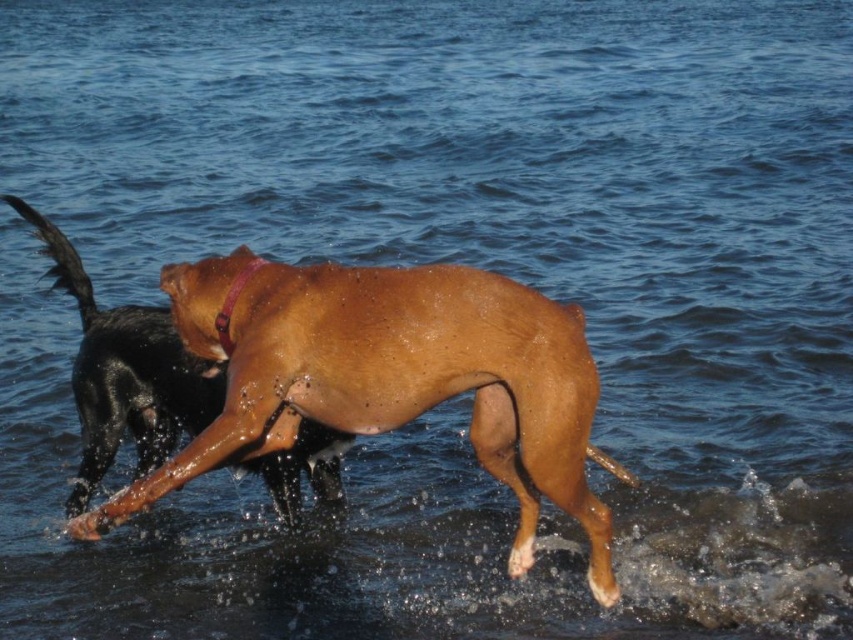
Question: Can you confirm if sandy brown fur at center is smaller than brown leather neckband at center?

Choices:
 (A) no
 (B) yes

Answer: (A)

Question: Which point appears closest to the camera in this image?

Choices:
 (A) pos(225,316)
 (B) pos(323,449)

Answer: (A)

Question: Is sandy brown fur at center smaller than brown glossy dog at center?

Choices:
 (A) yes
 (B) no

Answer: (A)

Question: Which of the following is the farthest from the observer?

Choices:
 (A) brown glossy dog at center
 (B) sandy brown fur at center
 (C) brown leather neckband at center

Answer: (A)

Question: Which point is closer to the camera?

Choices:
 (A) brown leather neckband at center
 (B) sandy brown fur at center
 (C) brown glossy dog at center

Answer: (B)

Question: Is sandy brown fur at center above brown leather neckband at center?

Choices:
 (A) yes
 (B) no

Answer: (B)